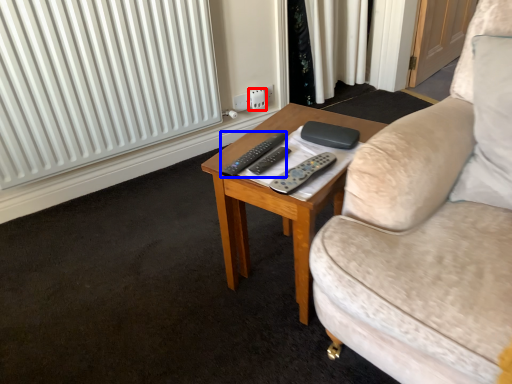
Question: Which of the following is the farthest to the observer, electric outlet (highlighted by a red box) or remote control (highlighted by a blue box)?

Choices:
 (A) electric outlet
 (B) remote control

Answer: (A)